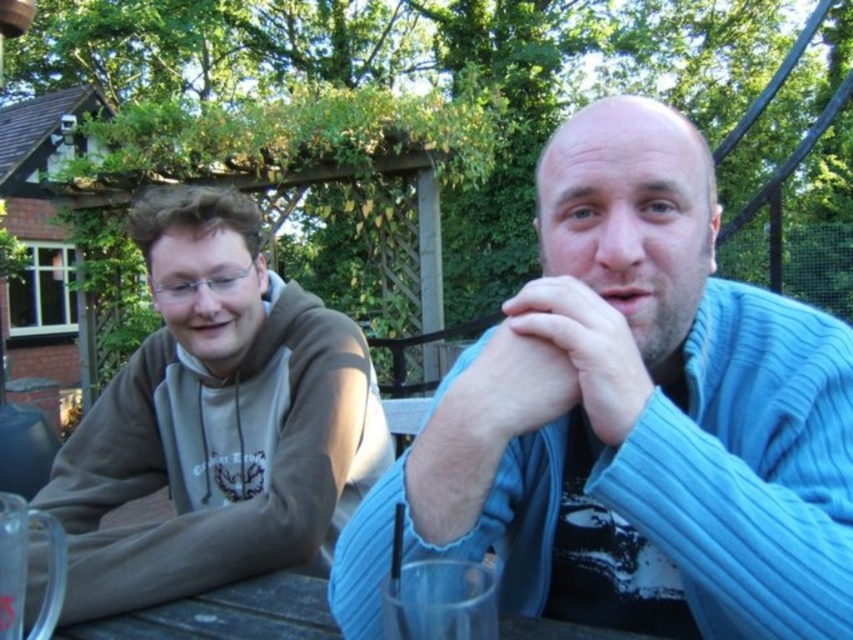
What is the 2D coordinate of the blue ribbed sweater at center?

The blue ribbed sweater at center is located at the 2D coordinate point of (631, 419).